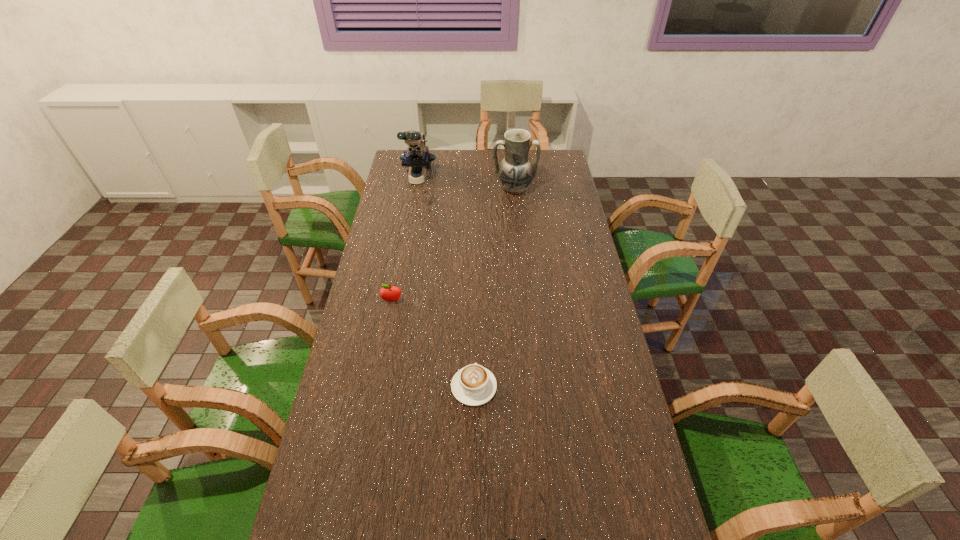
Where is `microscope`? The image size is (960, 540). microscope is located at coordinates [x=418, y=159].

Identify the location of pitcher. (515, 173).

Locate an element on the screen. The width and height of the screenshot is (960, 540). the third nearest object is located at coordinates click(x=391, y=294).

I want to click on apple, so click(x=391, y=294).

Image resolution: width=960 pixels, height=540 pixels. I want to click on the second shortest object, so click(x=473, y=385).

Find the location of a particular element. the third object from right to left is located at coordinates (473, 385).

You are a GUI agent. You are given a task and a screenshot of the screen. Output one action in this format:
    pyautogui.click(x=<x>, y=<y>)
    Task: Click on the free point located through the eyepieces of the microscope
    The height and width of the screenshot is (540, 960).
    Given the screenshot: What is the action you would take?
    pyautogui.click(x=414, y=200)

Where is `vacant area situated on the front-facing side of the pitcher`? The height and width of the screenshot is (540, 960). vacant area situated on the front-facing side of the pitcher is located at coordinates (520, 251).

Locate an element on the screen. This screenshot has height=540, width=960. vacant space located 0.120m on the right of the apple is located at coordinates (437, 301).

You are a GUI agent. You are given a task and a screenshot of the screen. Output one action in this format:
    pyautogui.click(x=<x>, y=<y>)
    Task: Click on the vacant space located with the handle on the right side of the cappuccino
    Image resolution: width=960 pixels, height=540 pixels.
    Given the screenshot: What is the action you would take?
    pyautogui.click(x=475, y=298)